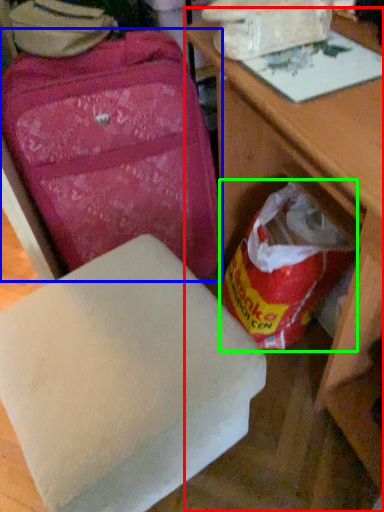
Question: Considering the real-world distances, which object is farthest from table (highlighted by a red box)? suitcase (highlighted by a blue box) or grocery bag (highlighted by a green box)?

Choices:
 (A) suitcase
 (B) grocery bag

Answer: (A)